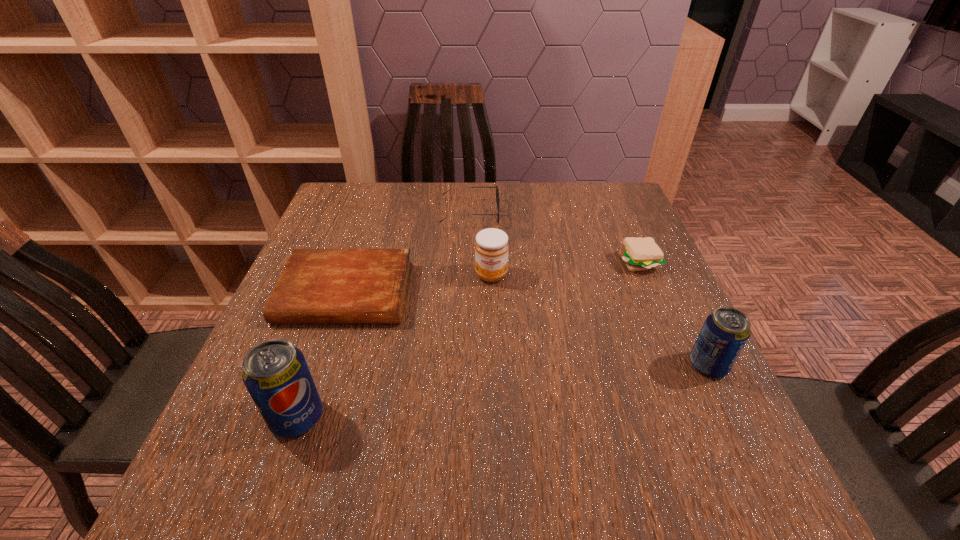
Find the location of a particular element. This screenshot has width=960, height=540. object located in the near left corner section of the desktop is located at coordinates (276, 375).

You are a GUI agent. You are given a task and a screenshot of the screen. Output one action in this format:
    pyautogui.click(x=<x>, y=<y>)
    Task: Click on the vacant space at the far edge of the desktop
    
    Given the screenshot: What is the action you would take?
    pyautogui.click(x=395, y=198)

In the image, there is a desktop. Where is `vacant region at the near edge`? vacant region at the near edge is located at coordinates (370, 438).

This screenshot has height=540, width=960. In the image, there is a desktop. Find the location of `vacant space at the left edge`. vacant space at the left edge is located at coordinates (348, 242).

This screenshot has width=960, height=540. Identify the location of free space at the right edge of the desktop. (620, 321).

You are a GUI agent. You are given a task and a screenshot of the screen. Output one action in this format:
    pyautogui.click(x=<x>, y=<y>)
    Task: Click on the vacant space at the far left corner
    This screenshot has width=960, height=540.
    Given the screenshot: What is the action you would take?
    pyautogui.click(x=362, y=220)

Where is `free space at the far right corner of the desktop`? free space at the far right corner of the desktop is located at coordinates (612, 195).

Find the location of `blank area at the near right corner`. blank area at the near right corner is located at coordinates (719, 420).

This screenshot has width=960, height=540. In order to click on free space between the Bible and the right soda in this screenshot , I will do click(527, 329).

Identify the location of free space between the fourth shortest object and the taller soda. (395, 346).